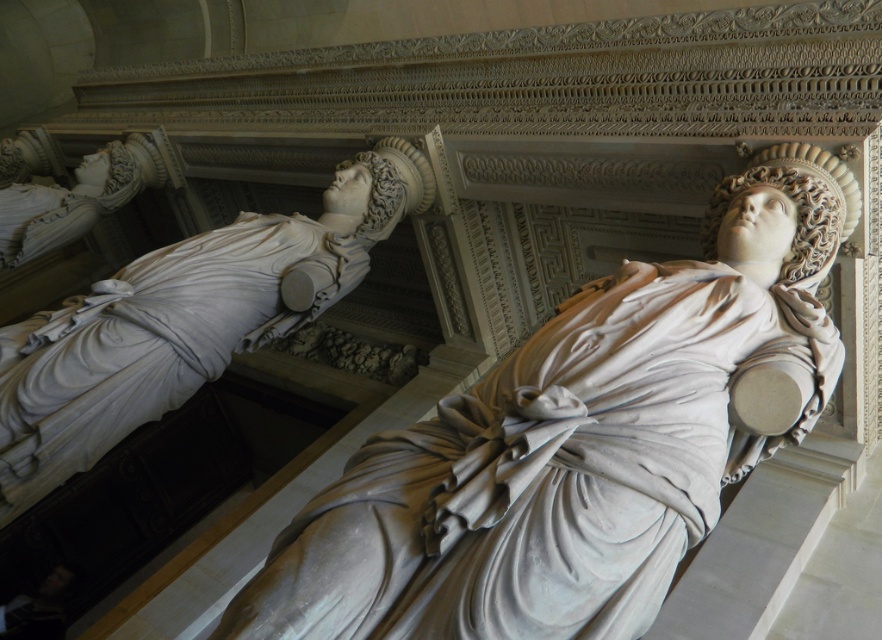
In the scene shown: You are an art conservator assessing the space between two statues in a classical building. You need to place a protective barrier between the white marble statue at center and the white marble statue at upper left. Which statue requires the barrier to be placed closer to it to ensure adequate spacing?

The white marble statue at center requires the barrier to be placed closer to it because it might be wider than the white marble statue at upper left, necessitating more space.

You are a tour guide leading a group through this historical building. You want to ensure that your group can clearly see the white marble statue at center from their current position. The average person in your group has a viewing height of 1.7 meters. Can you confirm if the statue is within a comfortable viewing distance?

The white marble statue at center is 3.64 meters from camera, which is within a comfortable viewing distance for someone with a viewing height of 1.7 meters. The group should be able to see it clearly.